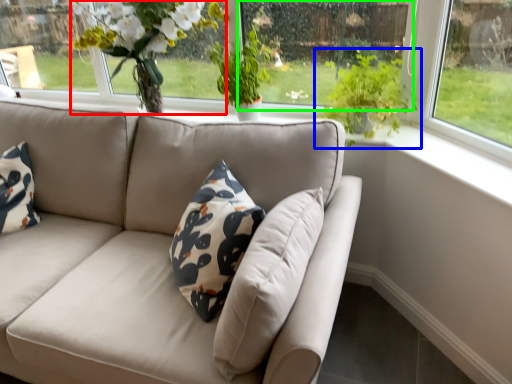
Question: Based on their relative distances, which object is farther from floral arrangement (highlighted by a red box)? Choose from houseplant (highlighted by a blue box) and window screen (highlighted by a green box).

Choices:
 (A) houseplant
 (B) window screen

Answer: (A)